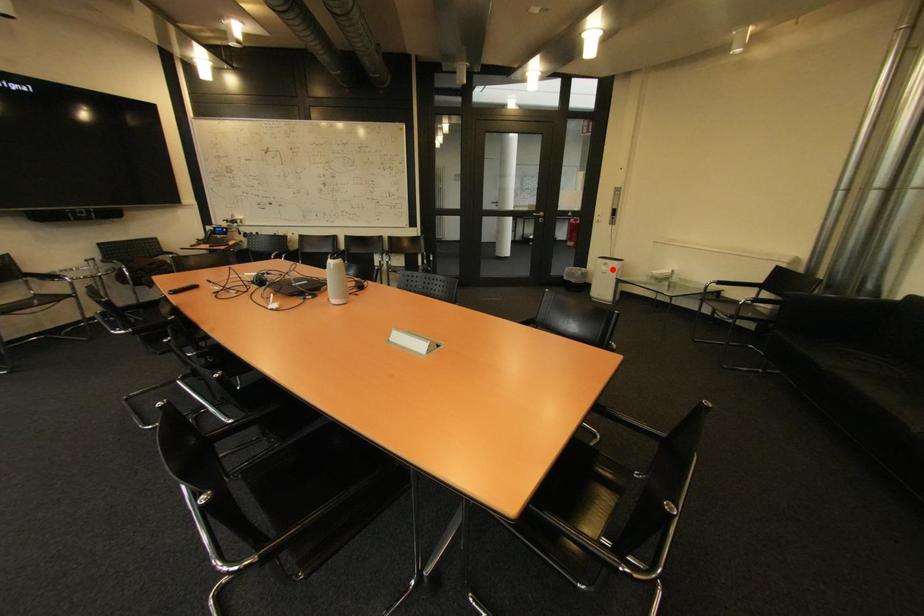
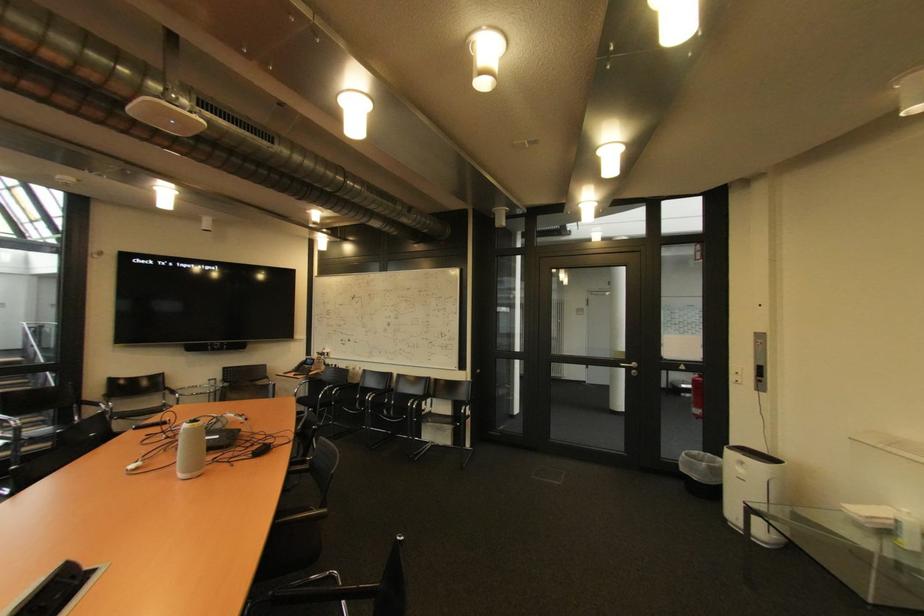
The point at the highlighted location is marked in the first image. Where is the corresponding point in the second image?

(748, 471)